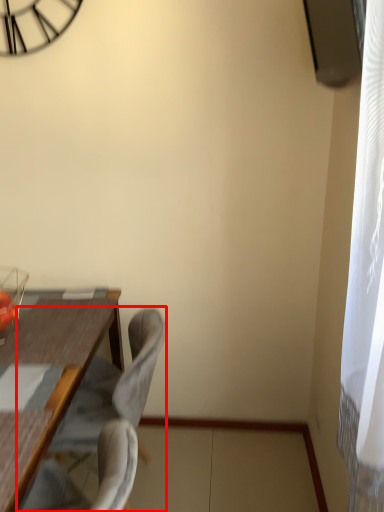
Question: From the image's perspective, considering the relative positions of chair (annotated by the red box) and swivel chair in the image provided, where is chair (annotated by the red box) located with respect to the staircase?

Choices:
 (A) above
 (B) below

Answer: (A)